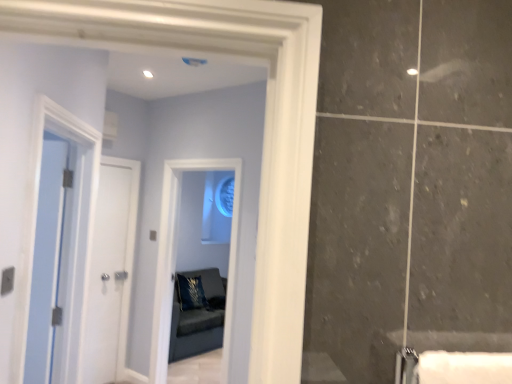
Question: Relative to blue glass window at center, is clear glass mirror at center in front or behind?

Choices:
 (A) behind
 (B) front

Answer: (A)

Question: Is clear glass mirror at center wider or thinner than blue glass window at center?

Choices:
 (A) wide
 (B) thin

Answer: (A)

Question: Based on their relative distances, which object is nearer to the blue velvet pillow at center?

Choices:
 (A) white glossy door at left, which is counted as the first door, starting from the back
 (B) white glossy door at left, which is counted as the 1th door, starting from the front
 (C) clear glass mirror at center
 (D) blue glass window at center

Answer: (D)

Question: Which object is positioned closest to the clear glass mirror at center?

Choices:
 (A) blue glass window at center
 (B) blue velvet pillow at center
 (C) white glossy door at left, the 2th door in the back-to-front sequence
 (D) white glossy door at left, which is counted as the first door, starting from the back

Answer: (B)